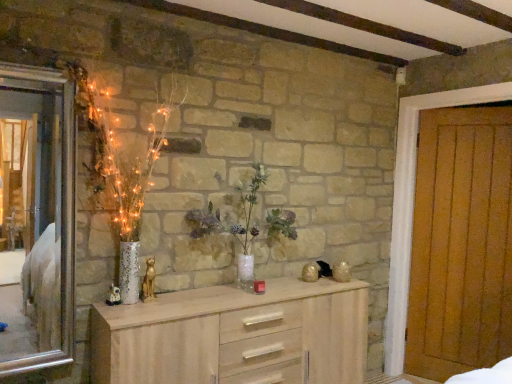
Locate an element on the screen. This screenshot has height=384, width=512. wooden door at right is located at coordinates [x=461, y=242].

Is translucent glass vase at center positioned before light wood chest of drawers at center?

No, it is not.

Is point (195, 221) positioned in front of point (298, 351)?

No, (195, 221) is further to viewer.

Would you say wooden door at right is to the left or to the right of light wood chest of drawers at center in the picture?

Based on their positions, wooden door at right is located to the right of light wood chest of drawers at center.

Is light wood chest of drawers at center located within wooden door at right?

Actually, light wood chest of drawers at center is outside wooden door at right.

Is wooden door at right bigger or smaller than light wood chest of drawers at center?

In the image, wooden door at right appears to be smaller than light wood chest of drawers at center.

From the image's perspective, is light wood chest of drawers at center below wooden door at right?

Yes, from the image's perspective, light wood chest of drawers at center is beneath wooden door at right.

Between point (227, 381) and point (469, 363), which one is positioned in front?

The point (227, 381) is more forward.

Is light wood chest of drawers at center oriented away from wooden door at right?

No.

Would you say light wood chest of drawers at center is to the left or to the right of wooden door at right in the picture?

light wood chest of drawers at center is positioned on wooden door at right's left side.

Looking at this image, is translucent glass vase at center taller or shorter than wooden door at right?

In the image, translucent glass vase at center appears to be shorter than wooden door at right.

Looking at the image, does translucent glass vase at center seem bigger or smaller compared to wooden door at right?

Clearly, translucent glass vase at center is smaller in size than wooden door at right.

From a real-world perspective, is translucent glass vase at center physically located above or below wooden door at right?

A: Clearly, from a real-world perspective, translucent glass vase at center is above wooden door at right.

Is point (245, 246) positioned before point (486, 210)?

Yes, it is in front of point (486, 210).

Which is behind, point (249, 206) or point (22, 211)?

The point (249, 206) is more distant.

Is translucent glass vase at center with silver metallic mirror at left?

No.

Could you tell me if translucent glass vase at center is facing silver metallic mirror at left?

No.

Considering the relative sizes of translucent glass vase at center and silver metallic mirror at left in the image provided, is translucent glass vase at center shorter than silver metallic mirror at left?

Correct, translucent glass vase at center is not as tall as silver metallic mirror at left.

In order to click on door that is under the translucent glass vase at center (from a real-world perspective) in this screenshot , I will do `click(461, 242)`.

From the image's perspective, which one is positioned lower, wooden door at right or translucent glass vase at center?

wooden door at right appears lower in the image.

Between point (508, 248) and point (203, 232), which one is positioned behind?

The point (508, 248) is farther from the camera.

From a real-world perspective, which is physically above, wooden door at right or silver metallic mirror at left?

In real-world perspective, silver metallic mirror at left is above.

In order to click on door below the silver metallic mirror at left (from a real-world perspective) in this screenshot , I will do `click(461, 242)`.

From the image's perspective, which is below, wooden door at right or silver metallic mirror at left?

From the image's view, wooden door at right is below.

Does wooden door at right turn towards silver metallic mirror at left?

Yes, wooden door at right faces towards silver metallic mirror at left.

This screenshot has height=384, width=512. What are the coordinates of `floral arrangement that is on the right side of light wood chest of drawers at center` in the screenshot? It's located at (227, 222).

Where is `chest of drawers on the left of wooden door at right`? This screenshot has width=512, height=384. chest of drawers on the left of wooden door at right is located at coordinates (234, 336).

Which object lies further to the anchor point wooden door at right, light wood chest of drawers at center or silver metallic mirror at left?

Among the two, silver metallic mirror at left is located further to wooden door at right.

When comparing their distances from translucent glass vase at center, does light wood chest of drawers at center or wooden door at right seem further?

wooden door at right is further to translucent glass vase at center.

Estimate the real-world distances between objects in this image. Which object is closer to translucent glass vase at center, silver metallic mirror at left or light wood chest of drawers at center?

The object closer to translucent glass vase at center is light wood chest of drawers at center.

When comparing their distances from translucent glass vase at center, does light wood chest of drawers at center or silver metallic mirror at left seem closer?

light wood chest of drawers at center is closer to translucent glass vase at center.

Looking at the image, which one is located closer to silver metallic mirror at left, translucent glass vase at center or light wood chest of drawers at center?

light wood chest of drawers at center lies closer to silver metallic mirror at left than the other object.

Looking at the image, which one is located further to silver metallic mirror at left, wooden door at right or translucent glass vase at center?

Based on the image, wooden door at right appears to be further to silver metallic mirror at left.

From the image, which object appears to be farther from light wood chest of drawers at center, translucent glass vase at center or silver metallic mirror at left?

silver metallic mirror at left is further to light wood chest of drawers at center.

Which object lies nearer to the anchor point translucent glass vase at center, wooden door at right or silver metallic mirror at left?

wooden door at right is positioned closer to the anchor translucent glass vase at center.

Locate an element on the screen. Image resolution: width=512 pixels, height=384 pixels. floral arrangement between light wood chest of drawers at center and wooden door at right in the horizontal direction is located at coordinates (227, 222).

Find the location of `the chest of drawers situated between silver metallic mirror at left and translucent glass vase at center from left to right`. the chest of drawers situated between silver metallic mirror at left and translucent glass vase at center from left to right is located at coordinates (234, 336).

Locate an element on the screen. Image resolution: width=512 pixels, height=384 pixels. chest of drawers between silver metallic mirror at left and wooden door at right is located at coordinates (234, 336).

This screenshot has width=512, height=384. In order to click on floral arrangement situated between silver metallic mirror at left and wooden door at right from left to right in this screenshot , I will do `click(227, 222)`.